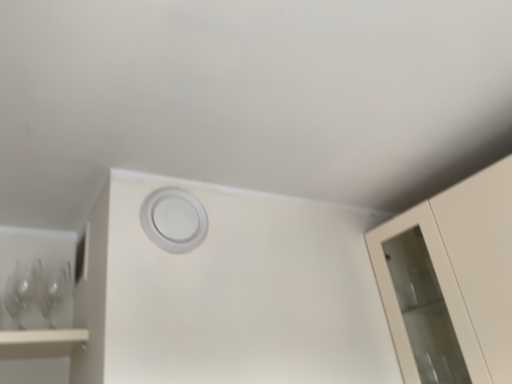
What do you see at coordinates (54, 292) in the screenshot?
I see `clear glass wine glass at left, marked as the 1th wine glass in a right-to-left arrangement` at bounding box center [54, 292].

At what (x,y) coordinates should I click in order to perform the action: click on white matte circle at center. Please return your answer as a coordinate pair (x, y). The image size is (512, 384). Looking at the image, I should click on (174, 220).

Relative to transparent glass wine glass at left, positioned as the first wine glass in left-to-right order, is clear glass wine glass at left, the 2th wine glass from the left, in front or behind?

In the image, clear glass wine glass at left, the 2th wine glass from the left, appears behind transparent glass wine glass at left, positioned as the first wine glass in left-to-right order.

How many degrees apart are the facing directions of clear glass wine glass at left, marked as the 1th wine glass in a right-to-left arrangement, and transparent glass wine glass at left, marked as the 2th wine glass in a right-to-left arrangement?

The facing directions of clear glass wine glass at left, marked as the 1th wine glass in a right-to-left arrangement, and transparent glass wine glass at left, marked as the 2th wine glass in a right-to-left arrangement, are 0 degrees apart.

Considering the positions of points (56, 296) and (20, 321), is point (56, 296) farther from camera compared to point (20, 321)?

Yes, point (56, 296) is farther from viewer.

Can we say clear glass wine glass at left, the 2th wine glass from the left, lies outside transparent glass wine glass at left, positioned as the first wine glass in left-to-right order?

clear glass wine glass at left, the 2th wine glass from the left, lies outside transparent glass wine glass at left, positioned as the first wine glass in left-to-right order,'s area.

Based on the photo, from the image's perspective, relative to white matte circle at center, is transparent glass wine glass at left, marked as the 2th wine glass in a right-to-left arrangement, above or below?

transparent glass wine glass at left, marked as the 2th wine glass in a right-to-left arrangement, is below white matte circle at center.

Identify the location of circle above the transparent glass wine glass at left, positioned as the first wine glass in left-to-right order (from the image's perspective). (174, 220).

Looking at this image, is transparent glass wine glass at left, positioned as the first wine glass in left-to-right order, smaller than white matte circle at center?

No.

How many degrees apart are the facing directions of transparent glass wine glass at left, positioned as the first wine glass in left-to-right order, and white matte circle at center?

The angular difference between transparent glass wine glass at left, positioned as the first wine glass in left-to-right order, and white matte circle at center is 2.9 degrees.

Which point is more distant from viewer, (62, 267) or (188, 224)?

Positioned behind is point (62, 267).

Is clear glass wine glass at left, marked as the 1th wine glass in a right-to-left arrangement, oriented towards white matte circle at center?

No, clear glass wine glass at left, marked as the 1th wine glass in a right-to-left arrangement, is not facing towards white matte circle at center.

Are clear glass wine glass at left, marked as the 1th wine glass in a right-to-left arrangement, and white matte circle at center located far from each other?

No, clear glass wine glass at left, marked as the 1th wine glass in a right-to-left arrangement, is not far from white matte circle at center.

From the image's perspective, is clear glass wine glass at left, the 2th wine glass from the left, above or below white matte circle at center?

Based on their image positions, clear glass wine glass at left, the 2th wine glass from the left, is located beneath white matte circle at center.

Who is shorter, white matte circle at center or clear glass wine glass at left, the 2th wine glass from the left?

clear glass wine glass at left, the 2th wine glass from the left.

Can you see white matte circle at center touching clear glass wine glass at left, marked as the 1th wine glass in a right-to-left arrangement?

No, white matte circle at center is not touching clear glass wine glass at left, marked as the 1th wine glass in a right-to-left arrangement.

Is white matte circle at center smaller than clear glass wine glass at left, the 2th wine glass from the left?

Indeed, white matte circle at center has a smaller size compared to clear glass wine glass at left, the 2th wine glass from the left.

From a real-world perspective, is white matte circle at center above or below clear glass wine glass at left, the 2th wine glass from the left?

white matte circle at center is above clear glass wine glass at left, the 2th wine glass from the left.

In the image, is transparent glass wine glass at left, marked as the 2th wine glass in a right-to-left arrangement, positioned in front of or behind clear glass wine glass at left, the 2th wine glass from the left?

transparent glass wine glass at left, marked as the 2th wine glass in a right-to-left arrangement, is in front of clear glass wine glass at left, the 2th wine glass from the left.

Is transparent glass wine glass at left, marked as the 2th wine glass in a right-to-left arrangement, placed right next to clear glass wine glass at left, marked as the 1th wine glass in a right-to-left arrangement?

Yes, transparent glass wine glass at left, marked as the 2th wine glass in a right-to-left arrangement, is beside clear glass wine glass at left, marked as the 1th wine glass in a right-to-left arrangement.

Is transparent glass wine glass at left, marked as the 2th wine glass in a right-to-left arrangement, outside of clear glass wine glass at left, the 2th wine glass from the left?

Yes, transparent glass wine glass at left, marked as the 2th wine glass in a right-to-left arrangement, is not within clear glass wine glass at left, the 2th wine glass from the left.

Can you confirm if transparent glass wine glass at left, marked as the 2th wine glass in a right-to-left arrangement, is taller than clear glass wine glass at left, marked as the 1th wine glass in a right-to-left arrangement?

No.

From the image's perspective, is white matte circle at center under transparent glass wine glass at left, marked as the 2th wine glass in a right-to-left arrangement?

No, from the image's perspective, white matte circle at center is not beneath transparent glass wine glass at left, marked as the 2th wine glass in a right-to-left arrangement.

Consider the image. In terms of size, does white matte circle at center appear bigger or smaller than transparent glass wine glass at left, positioned as the first wine glass in left-to-right order?

Considering their sizes, white matte circle at center takes up less space than transparent glass wine glass at left, positioned as the first wine glass in left-to-right order.

Between white matte circle at center and transparent glass wine glass at left, positioned as the first wine glass in left-to-right order, which one has less height?

transparent glass wine glass at left, positioned as the first wine glass in left-to-right order, is shorter.

What are the coordinates of `wine glass directly beneath the transparent glass wine glass at left, marked as the 2th wine glass in a right-to-left arrangement (from a real-world perspective)` in the screenshot? It's located at (54, 292).

What are the coordinates of `circle that is above the transparent glass wine glass at left, marked as the 2th wine glass in a right-to-left arrangement (from a real-world perspective)` in the screenshot? It's located at (174, 220).

From the image, which object appears to be nearer to transparent glass wine glass at left, positioned as the first wine glass in left-to-right order, clear glass wine glass at left, marked as the 1th wine glass in a right-to-left arrangement, or white matte circle at center?

clear glass wine glass at left, marked as the 1th wine glass in a right-to-left arrangement, is positioned closer to the anchor transparent glass wine glass at left, positioned as the first wine glass in left-to-right order.

Looking at this image, estimate the real-world distances between objects in this image. Which object is further from clear glass wine glass at left, the 2th wine glass from the left, transparent glass wine glass at left, positioned as the first wine glass in left-to-right order, or white matte circle at center?

white matte circle at center is further to clear glass wine glass at left, the 2th wine glass from the left.

Which object lies nearer to the anchor point white matte circle at center, clear glass wine glass at left, marked as the 1th wine glass in a right-to-left arrangement, or transparent glass wine glass at left, marked as the 2th wine glass in a right-to-left arrangement?

clear glass wine glass at left, marked as the 1th wine glass in a right-to-left arrangement, is closer to white matte circle at center.

Which object lies nearer to the anchor point transparent glass wine glass at left, positioned as the first wine glass in left-to-right order, white matte circle at center or clear glass wine glass at left, marked as the 1th wine glass in a right-to-left arrangement?

clear glass wine glass at left, marked as the 1th wine glass in a right-to-left arrangement, is closer to transparent glass wine glass at left, positioned as the first wine glass in left-to-right order.

Looking at the image, which one is located further to white matte circle at center, transparent glass wine glass at left, marked as the 2th wine glass in a right-to-left arrangement, or clear glass wine glass at left, the 2th wine glass from the left?

transparent glass wine glass at left, marked as the 2th wine glass in a right-to-left arrangement, is positioned further to the anchor white matte circle at center.

When comparing their distances from clear glass wine glass at left, the 2th wine glass from the left, does white matte circle at center or transparent glass wine glass at left, marked as the 2th wine glass in a right-to-left arrangement, seem closer?

Among the two, transparent glass wine glass at left, marked as the 2th wine glass in a right-to-left arrangement, is located nearer to clear glass wine glass at left, the 2th wine glass from the left.

What are the coordinates of `wine glass located between transparent glass wine glass at left, positioned as the first wine glass in left-to-right order, and white matte circle at center in the left-right direction` in the screenshot? It's located at (54, 292).